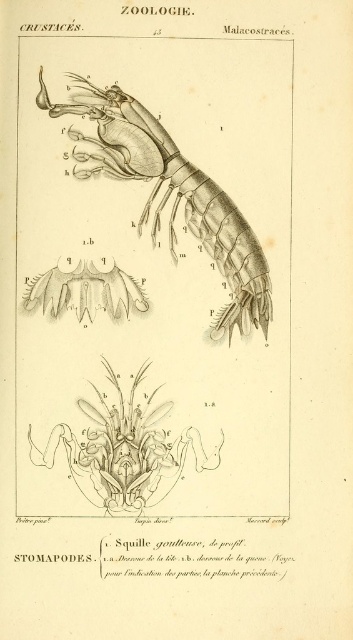
Question: Estimate the real-world distances between objects in this image. Which object is closer to the translucent gray appendage at center?

Choices:
 (A) grayish-white spines at center
 (B) translucent gray shrimp at center

Answer: (A)

Question: Is translucent gray shrimp at center wider than grayish-white spines at center?

Choices:
 (A) yes
 (B) no

Answer: (A)

Question: Which point is farther to the camera?

Choices:
 (A) (158, 451)
 (B) (254, 304)
 (C) (66, 298)

Answer: (B)

Question: Does translucent gray appendage at center appear on the left side of grayish-white spines at center?

Choices:
 (A) no
 (B) yes

Answer: (A)

Question: Is translucent gray shrimp at center thinner than translucent gray appendage at center?

Choices:
 (A) yes
 (B) no

Answer: (B)

Question: Which object is the closest to the grayish-white spines at center?

Choices:
 (A) translucent gray shrimp at center
 (B) translucent gray appendage at center

Answer: (A)